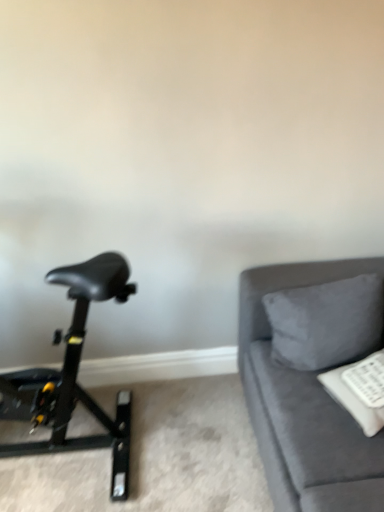
Locate an element on the screen. This screenshot has height=512, width=384. suede gray pillow at right is located at coordinates (326, 322).

Image resolution: width=384 pixels, height=512 pixels. Describe the element at coordinates (304, 406) in the screenshot. I see `velvet gray couch at right` at that location.

What are the coordinates of `velvet gray couch at right` in the screenshot? It's located at (304, 406).

You are a GUI agent. You are given a task and a screenshot of the screen. Output one action in this format:
    pyautogui.click(x=<x>, y=<y>)
    Task: Click on the suede gray pillow at right
    This screenshot has width=384, height=512.
    Given the screenshot: What is the action you would take?
    pyautogui.click(x=326, y=322)

From a real-world perspective, is velvet gray couch at right over suede gray pillow at right?

No, from a real-world perspective, velvet gray couch at right is not over suede gray pillow at right

Between velvet gray couch at right and suede gray pillow at right, which one has more height?

velvet gray couch at right.

In the image, is velvet gray couch at right positioned in front of or behind suede gray pillow at right?

In the image, velvet gray couch at right appears in front of suede gray pillow at right.

Looking at this image, is suede gray pillow at right next to velvet gray couch at right?

No, suede gray pillow at right is not touching velvet gray couch at right.

Is suede gray pillow at right facing away from velvet gray couch at right?

Yes, suede gray pillow at right's orientation is away from velvet gray couch at right.

Is point (293, 303) closer or farther from the camera than point (363, 499)?

Point (293, 303) is farther from the camera than point (363, 499).

Considering the sizes of suede gray pillow at right and velvet gray couch at right in the image, is suede gray pillow at right wider or thinner than velvet gray couch at right?

In the image, suede gray pillow at right appears to be more narrow than velvet gray couch at right.

From a real-world perspective, is suede gray pillow at right beneath black matte stationary bicycle at left?

Yes, from a real-world perspective, suede gray pillow at right is below black matte stationary bicycle at left.

From the image's perspective, relative to black matte stationary bicycle at left, is suede gray pillow at right above or below?

Based on their image positions, suede gray pillow at right is located above black matte stationary bicycle at left.

Would you say suede gray pillow at right is a long distance from black matte stationary bicycle at left?

Actually, suede gray pillow at right and black matte stationary bicycle at left are a little close together.

Between suede gray pillow at right and black matte stationary bicycle at left, which one appears on the left side from the viewer's perspective?

Positioned to the left is black matte stationary bicycle at left.

Find the location of a particular element. The image size is (384, 512). stationary bicycle that appears above the velvet gray couch at right (from a real-world perspective) is located at coordinates (73, 375).

Is black matte stationary bicycle at left surrounded by velvet gray couch at right?

No, velvet gray couch at right does not contain black matte stationary bicycle at left.

Are velvet gray couch at right and black matte stationary bicycle at left located far from each other?

No, velvet gray couch at right is not far from black matte stationary bicycle at left.

Is velvet gray couch at right to the left of black matte stationary bicycle at left from the viewer's perspective?

Incorrect, velvet gray couch at right is not on the left side of black matte stationary bicycle at left.

This screenshot has width=384, height=512. Identify the location of stationary bicycle on the left side of velvet gray couch at right. (73, 375).

Consider the image. Which object is thinner, black matte stationary bicycle at left or velvet gray couch at right?

black matte stationary bicycle at left is thinner.

Which is closer, (129,272) or (359,265)?

The point (359,265) is more forward.

Based on the photo, does black matte stationary bicycle at left turn towards velvet gray couch at right?

No, black matte stationary bicycle at left is not turned towards velvet gray couch at right.

Considering the relative sizes of black matte stationary bicycle at left and suede gray pillow at right in the image provided, is black matte stationary bicycle at left smaller than suede gray pillow at right?

No.

Considering the relative sizes of black matte stationary bicycle at left and suede gray pillow at right in the image provided, is black matte stationary bicycle at left thinner than suede gray pillow at right?

No.

Would you say black matte stationary bicycle at left is a long distance from suede gray pillow at right?

No, there isn't a large distance between black matte stationary bicycle at left and suede gray pillow at right.

This screenshot has height=512, width=384. Find the location of `pillow behind the velvet gray couch at right`. pillow behind the velvet gray couch at right is located at coordinates (326, 322).

Where is `pillow above the velvet gray couch at right (from a real-world perspective)`? This screenshot has height=512, width=384. pillow above the velvet gray couch at right (from a real-world perspective) is located at coordinates (326, 322).

When comparing their distances from black matte stationary bicycle at left, does velvet gray couch at right or suede gray pillow at right seem further?

suede gray pillow at right is positioned further to the anchor black matte stationary bicycle at left.

Looking at the image, which one is located further to black matte stationary bicycle at left, suede gray pillow at right or velvet gray couch at right?

Among the two, suede gray pillow at right is located further to black matte stationary bicycle at left.

Which object lies nearer to the anchor point velvet gray couch at right, suede gray pillow at right or black matte stationary bicycle at left?

suede gray pillow at right lies closer to velvet gray couch at right than the other object.

From the image, which object appears to be farther from suede gray pillow at right, black matte stationary bicycle at left or velvet gray couch at right?

black matte stationary bicycle at left is further to suede gray pillow at right.

Estimate the real-world distances between objects in this image. Which object is further from suede gray pillow at right, velvet gray couch at right or black matte stationary bicycle at left?

Among the two, black matte stationary bicycle at left is located further to suede gray pillow at right.

Based on their spatial positions, is black matte stationary bicycle at left or suede gray pillow at right closer to velvet gray couch at right?

suede gray pillow at right is closer to velvet gray couch at right.

This screenshot has width=384, height=512. Identify the location of pillow between black matte stationary bicycle at left and velvet gray couch at right from left to right. (326, 322).